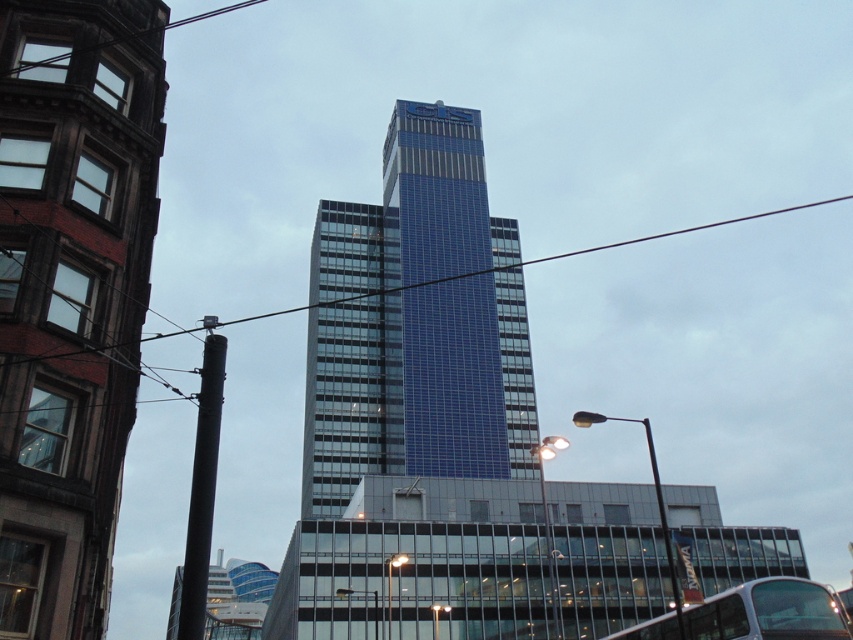
Is blue glassy tower at center smaller than silver metallic bus at lower right?

No.

Is blue glassy tower at center to the right of silver metallic bus at lower right from the viewer's perspective?

In fact, blue glassy tower at center is to the left of silver metallic bus at lower right.

Which is behind, point (343, 376) or point (634, 627)?

Point (343, 376)

Locate an element on the screen. blue glassy tower at center is located at coordinates (416, 323).

Does blue glass building at center appear on the right side of silver metallic bus at lower right?

Incorrect, blue glass building at center is not on the right side of silver metallic bus at lower right.

Which is behind, point (442, 145) or point (746, 616)?

The point (442, 145) is behind.

Between point (503, 461) and point (669, 620), which one is positioned behind?

Point (503, 461)

Find the location of `blue glass building at center`. blue glass building at center is located at coordinates (445, 292).

Is blue glassy tower at center positioned at the back of blue glass building at center?

No, it is in front of blue glass building at center.

Which is behind, point (318, 262) or point (434, 349)?

Point (318, 262)

Is point (488, 436) less distant than point (426, 179)?

Yes, point (488, 436) is closer to viewer.

You are a GUI agent. You are given a task and a screenshot of the screen. Output one action in this format:
    pyautogui.click(x=<x>, y=<y>)
    Task: Click on the blue glassy tower at center
    The height and width of the screenshot is (640, 853).
    Given the screenshot: What is the action you would take?
    pyautogui.click(x=416, y=323)